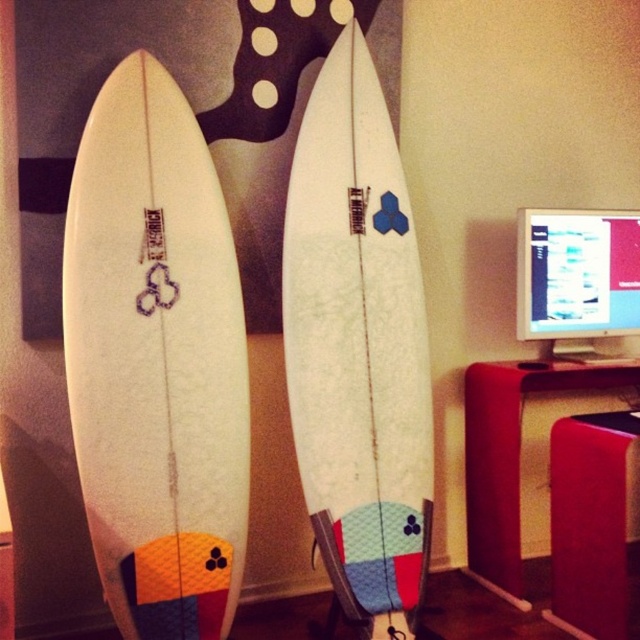
Consider the image. You are setting up a small office space and need to place the matte red stool at lower right and the matte white monitor at upper right. Considering their sizes, which object should be placed closer to the desk to ensure comfort and functionality?

The matte red stool at lower right is larger in size compared to the matte white monitor at upper right. To ensure comfort and functionality, the larger matte red stool at lower right should be placed closer to the desk, while the smaller matte white monitor at upper right can be positioned slightly further back or to the side.

You are setting up a home office and need to place the matte red stool at lower right so that it faces the matte white monitor at upper right. Can you position the stool in front of the monitor without blocking the view of the monitor?

The matte red stool at lower right is already positioned in front of the matte white monitor at upper right, so placing it there would block the monitor. To avoid blocking the view, the stool should be placed behind the monitor or moved to a different location where it doesn not obstruct the screen.

You are organizing an office space and need to place a new keyboard on the desk. You see the matte red desk at lower right and the matte white monitor at upper right. Which object should the keyboard be placed on?

The keyboard should be placed on the matte red desk at lower right because the matte white monitor at upper right is located above it and is likely a screen, not a surface for placing items.